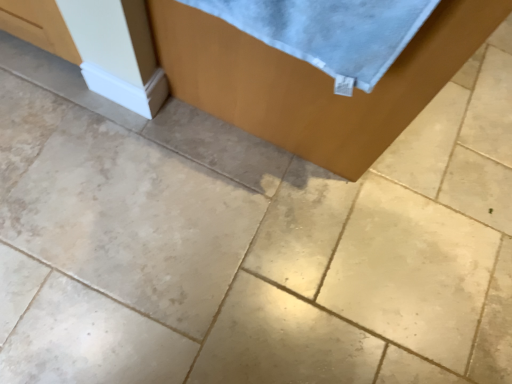
Locate an element on the screen. Image resolution: width=512 pixels, height=384 pixels. light blue cotton towel at upper right is located at coordinates (330, 32).

Image resolution: width=512 pixels, height=384 pixels. What do you see at coordinates (330, 32) in the screenshot?
I see `light blue cotton towel at upper right` at bounding box center [330, 32].

Locate an element on the screen. Image resolution: width=512 pixels, height=384 pixels. light blue cotton towel at upper right is located at coordinates (330, 32).